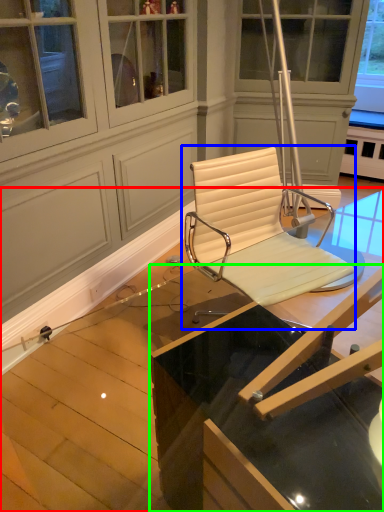
Question: Which object is positioned farthest from table (highlighted by a red box)? Select from chair (highlighted by a blue box) and table (highlighted by a green box).

Choices:
 (A) chair
 (B) table

Answer: (B)